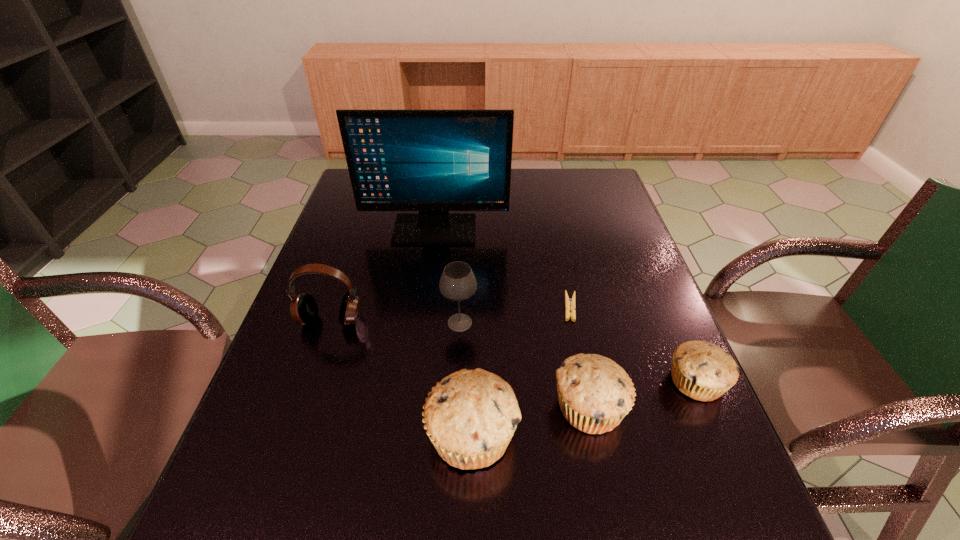
Identify the location of the leftmost muffin. This screenshot has height=540, width=960. (470, 416).

At what (x,y) coordinates should I click in order to perform the action: click on the fifth tallest object. Please return your answer as a coordinate pair (x, y). The height and width of the screenshot is (540, 960). Looking at the image, I should click on (594, 393).

Find the location of a particular element. the second shortest muffin is located at coordinates (594, 393).

You are a GUI agent. You are given a task and a screenshot of the screen. Output one action in this format:
    pyautogui.click(x=<x>, y=<y>)
    Task: Click on the rightmost object
    The height and width of the screenshot is (540, 960).
    Given the screenshot: What is the action you would take?
    tap(701, 370)

You are a GUI agent. You are given a task and a screenshot of the screen. Output one action in this format:
    pyautogui.click(x=<x>, y=<y>)
    Task: Click on the sixth tallest object
    
    Given the screenshot: What is the action you would take?
    coord(701,370)

The height and width of the screenshot is (540, 960). In order to click on wineglass in this screenshot , I will do `click(457, 283)`.

Where is `the tallest object`? Image resolution: width=960 pixels, height=540 pixels. the tallest object is located at coordinates (433, 161).

Image resolution: width=960 pixels, height=540 pixels. I want to click on monitor, so [x=433, y=161].

I want to click on headset, so click(304, 310).

The height and width of the screenshot is (540, 960). Identify the location of clothespin. (569, 303).